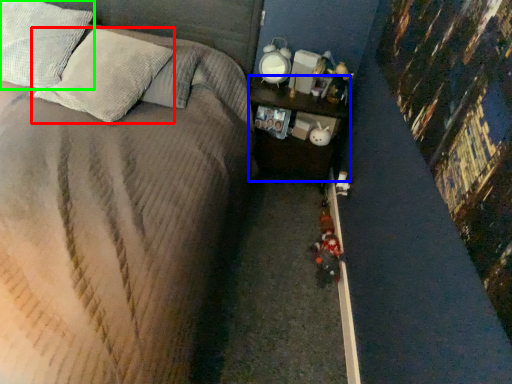
Question: Considering the real-world distances, which object is farthest from pillow (highlighted by a red box)? nightstand (highlighted by a blue box) or pillow (highlighted by a green box)?

Choices:
 (A) nightstand
 (B) pillow

Answer: (A)